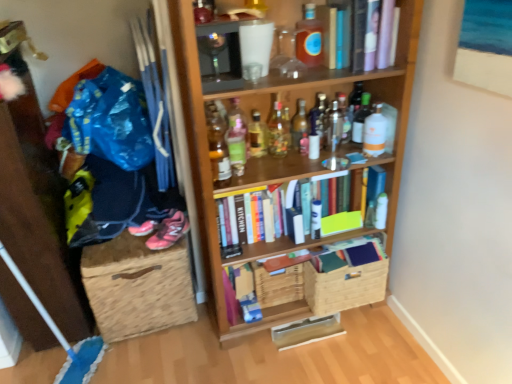
The image size is (512, 384). In order to click on vacant area on top of hardcover books at center, marked as the 2th book in a top-to-bottom arrangement (from a real-world perspective) in this screenshot , I will do `click(290, 170)`.